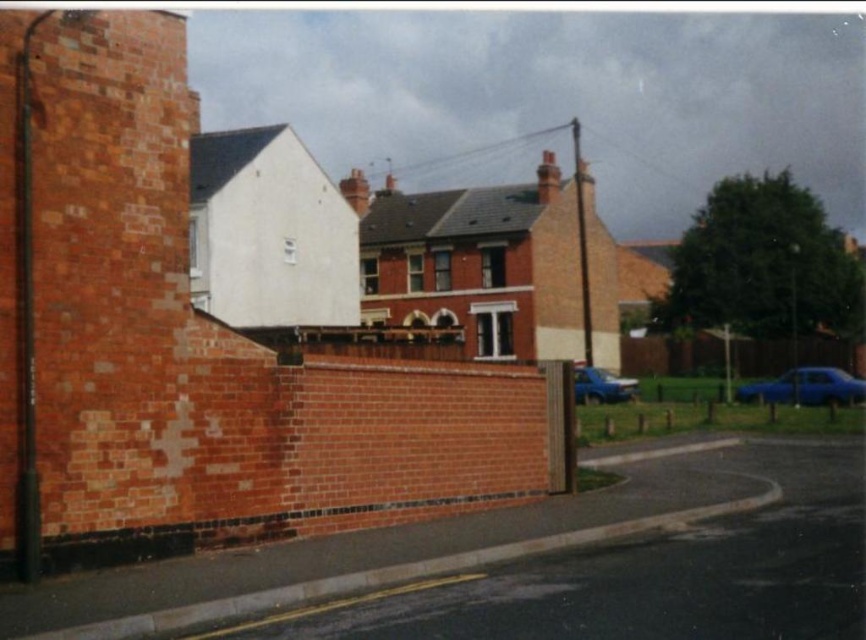
You are standing at the center of the image. Which direction should you walk to reach the blue matte car at right?

You should walk to the right to reach the blue matte car at right since it is located at the right side of the image.

You are a pedestrian standing on the sidewalk next to the large brick wall. You want to cross the road to reach the two story house with a red brick facade. Is there enough space between the blue matte car at right and the blue metallic car at lower right to safely cross?

The blue matte car at right is positioned over the blue metallic car at lower right, which means they are likely parked close together. There may not be enough space between them to safely cross the road. It would be better to look for a wider gap elsewhere.